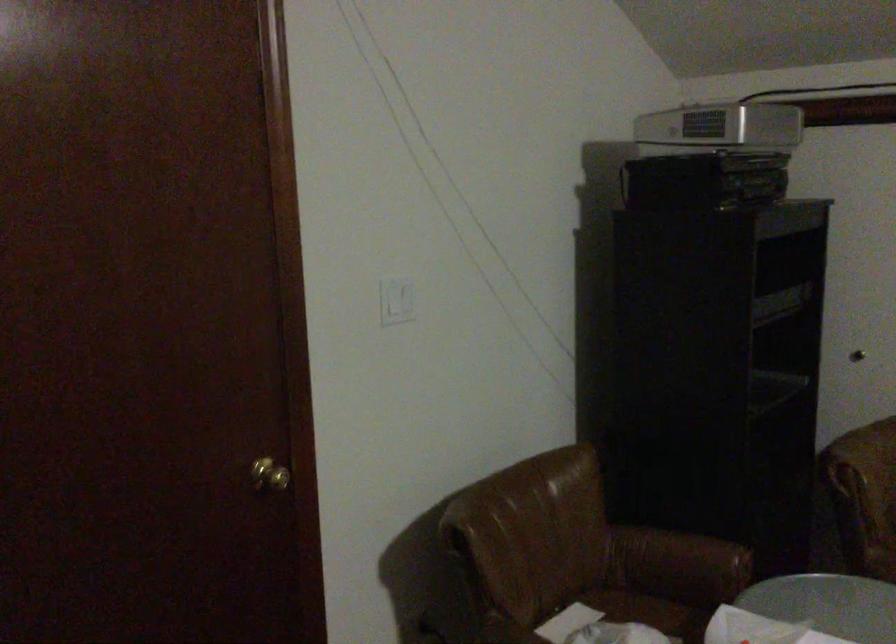
Where would you lift the silver projector? Please return your answer as a coordinate pair (x, y).

(719, 129)